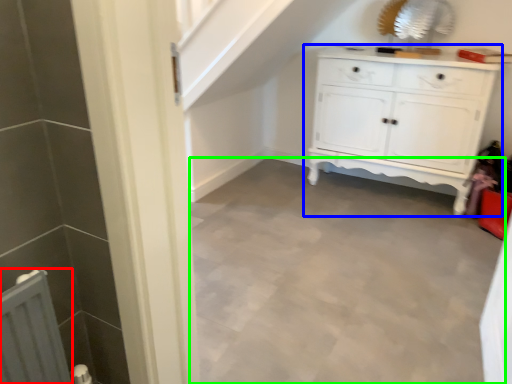
Question: Based on their relative distances, which object is farther from radiator (highlighted by a red box)? Choose from chest of drawers (highlighted by a blue box) and plain (highlighted by a green box).

Choices:
 (A) chest of drawers
 (B) plain

Answer: (A)